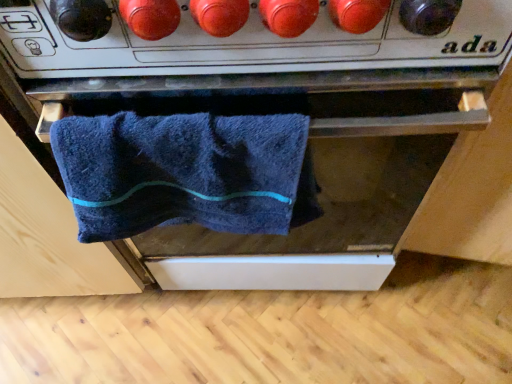
Find the location of a particular element. Image resolution: width=512 pixels, height=384 pixels. dark blue towel at center is located at coordinates (331, 199).

Image resolution: width=512 pixels, height=384 pixels. What do you see at coordinates (331, 199) in the screenshot?
I see `dark blue towel at center` at bounding box center [331, 199].

Where is `dark blue towel at center`? dark blue towel at center is located at coordinates (331, 199).